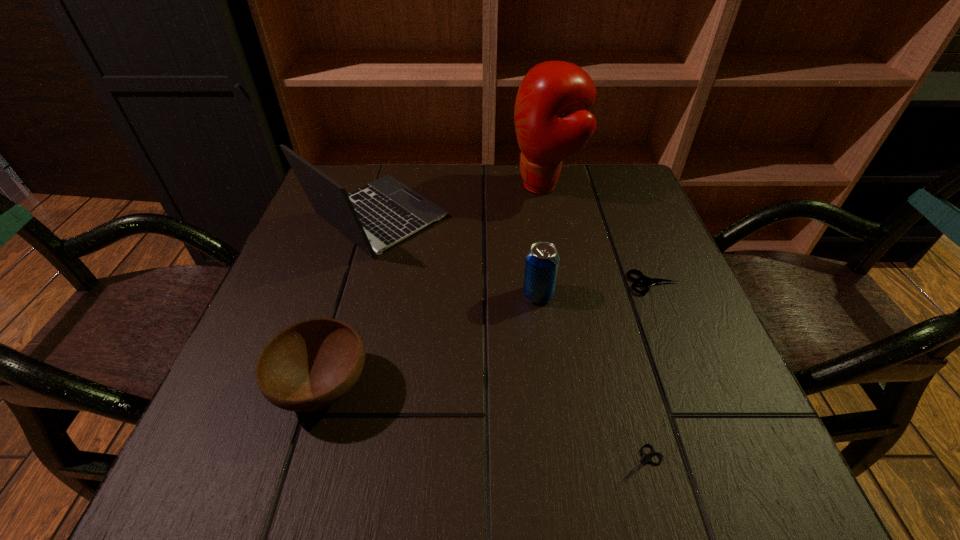
Where is `free space between the third tallest object and the laptop_computer`? The image size is (960, 540). free space between the third tallest object and the laptop_computer is located at coordinates (457, 256).

This screenshot has height=540, width=960. Identify the location of empty space between the right shears and the laptop_computer. (516, 250).

Where is `empty space that is in between the beer can and the laptop_computer`? empty space that is in between the beer can and the laptop_computer is located at coordinates (457, 256).

Find the location of `empty space that is in between the beer can and the second nearest object`. empty space that is in between the beer can and the second nearest object is located at coordinates (430, 341).

Identify which object is the third closest to the boxing glove. Please provide its 2D coordinates. Your answer should be formatted as a tuple, i.e. [(x, y)], where the tuple contains the x and y coordinates of a point satisfying the conditions above.

[(542, 260)]

Identify which object is located as the second nearest to the fifth shortest object. Please provide its 2D coordinates. Your answer should be formatted as a tuple, i.e. [(x, y)], where the tuple contains the x and y coordinates of a point satisfying the conditions above.

[(542, 260)]

Where is `free spot that satisfies the following two spatial constraints: 1. on the back side of the right shears; 2. on the left side of the bowl`? The height and width of the screenshot is (540, 960). free spot that satisfies the following two spatial constraints: 1. on the back side of the right shears; 2. on the left side of the bowl is located at coordinates (353, 283).

Identify the location of vacant space that satisfies the following two spatial constraints: 1. at the front screen of the laptop_computer; 2. on the back side of the fifth tallest object. This screenshot has height=540, width=960. (357, 283).

The image size is (960, 540). I want to click on vacant space that satisfies the following two spatial constraints: 1. at the front screen of the second tallest object; 2. on the left side of the nearest object, so click(305, 465).

Identify the location of vacant space that satisfies the following two spatial constraints: 1. on the striking surface of the left shears; 2. on the right side of the tallest object. This screenshot has width=960, height=540. (600, 465).